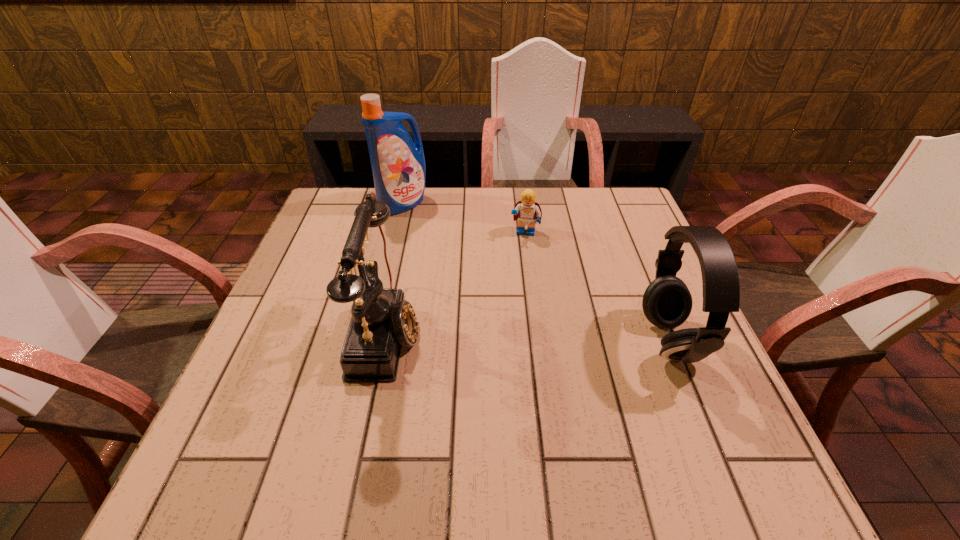
At what (x,y) coordinates should I click in order to perform the action: click on free spot between the second object from right to left and the detergent. Please return your answer as a coordinate pair (x, y). The image size is (960, 540). Looking at the image, I should click on (464, 218).

At what (x,y) coordinates should I click in order to perform the action: click on vacant space that is in between the telephone and the second farthest object. Please return your answer as a coordinate pair (x, y). Image resolution: width=960 pixels, height=540 pixels. Looking at the image, I should click on (456, 282).

Find the location of a particular element. vacant space that's between the second object from right to left and the farthest object is located at coordinates (464, 218).

At what (x,y) coordinates should I click in order to perform the action: click on free spot between the Lego and the detergent. Please return your answer as a coordinate pair (x, y). Looking at the image, I should click on (464, 218).

This screenshot has width=960, height=540. In order to click on vacant area that lies between the third object from left to right and the telephone in this screenshot , I will do (x=456, y=282).

Image resolution: width=960 pixels, height=540 pixels. Identify the location of unoccupied position between the detergent and the shortest object. (464, 218).

Identify the location of free space between the rightmost object and the telephone. (528, 336).

The image size is (960, 540). Find the location of `empty space that is in between the Lego and the earphone`. empty space that is in between the Lego and the earphone is located at coordinates (597, 287).

I want to click on the second closest object to the second object from right to left, so click(382, 321).

Locate which object ranks second in proximity to the detergent. Please provide its 2D coordinates. Your answer should be formatted as a tuple, i.e. [(x, y)], where the tuple contains the x and y coordinates of a point satisfying the conditions above.

[(382, 321)]